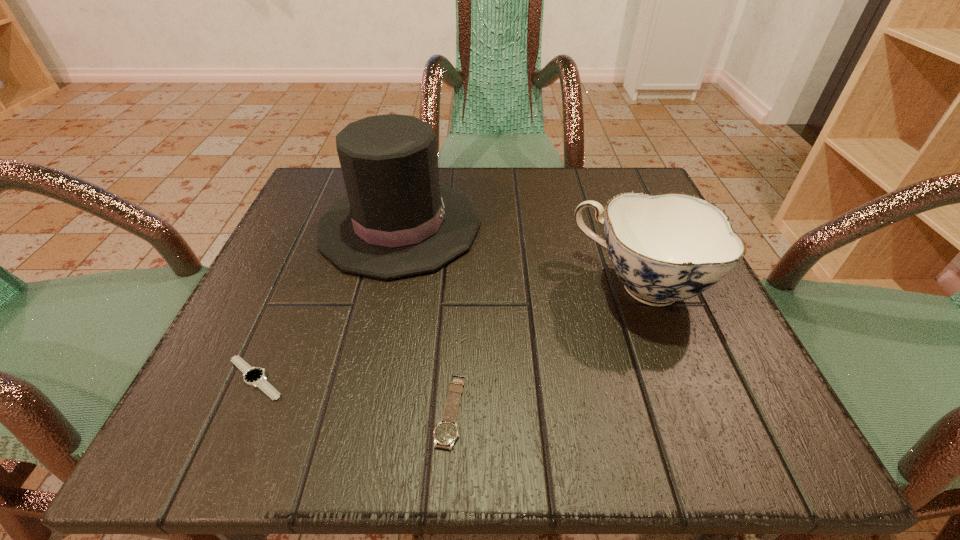
You are a GUI agent. You are given a task and a screenshot of the screen. Output one action in this format:
    pyautogui.click(x=<x>, y=<y>)
    Task: Click on the tallest object
    This screenshot has width=960, height=540.
    Given the screenshot: What is the action you would take?
    pyautogui.click(x=397, y=220)

Identify the location of chinaware. (667, 247).

Locate an element on the screen. the third shortest object is located at coordinates (667, 247).

Where is `the left watch`? The image size is (960, 540). the left watch is located at coordinates (254, 376).

The width and height of the screenshot is (960, 540). In order to click on the right watch in this screenshot , I will do `click(445, 434)`.

This screenshot has width=960, height=540. I want to click on free region located 0.070m on the front of the dress hat with the decoration, so click(517, 226).

What are the coordinates of `free space located on the left of the rightmost object` in the screenshot? It's located at (391, 285).

Find the location of a particular element. The width and height of the screenshot is (960, 540). vacant region located 0.380m on the back of the left watch is located at coordinates (330, 206).

Identify the location of vacant space located on the back of the right watch. The width and height of the screenshot is (960, 540). (461, 218).

Locate an element on the screen. Image resolution: width=960 pixels, height=540 pixels. object located at the far edge is located at coordinates (397, 220).